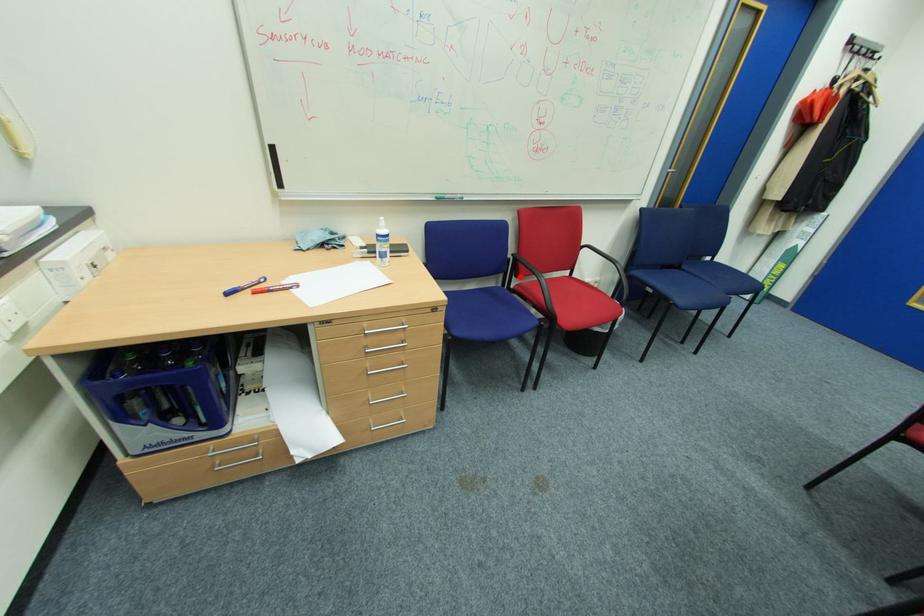
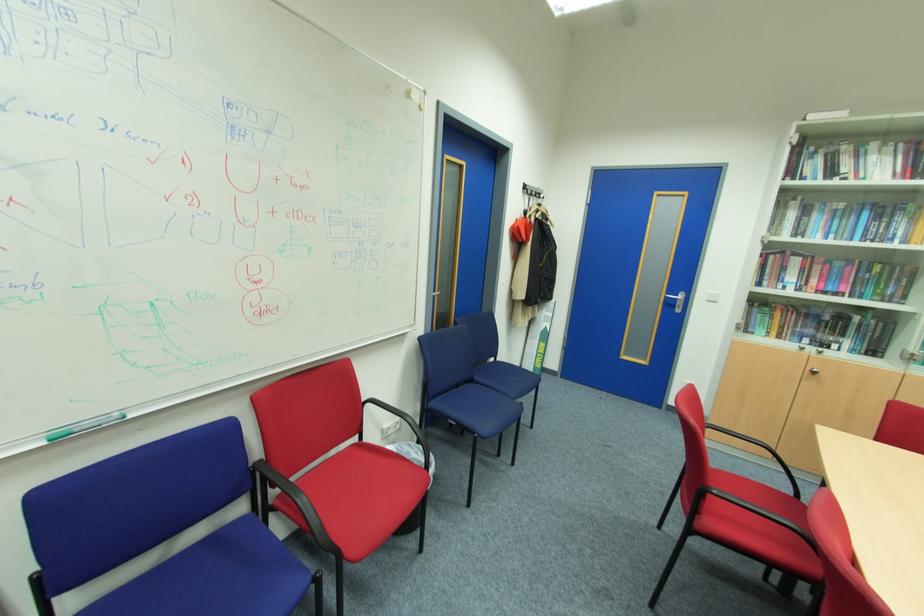
Where in the second image is the point corresponding to the highlighted location from the first image?

(277, 485)